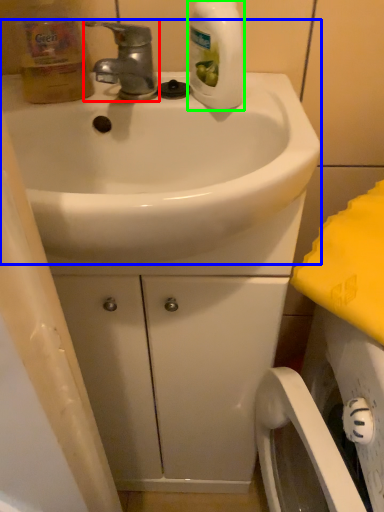
Question: Which object is positioned farthest from tap (highlighted by a red box)? Select from sink (highlighted by a blue box) and cleaning product (highlighted by a green box).

Choices:
 (A) sink
 (B) cleaning product

Answer: (A)